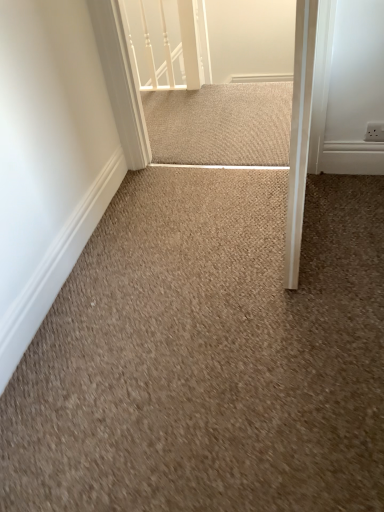
Question: Is beige textured mat at center oriented away from beige carpet at center?

Choices:
 (A) yes
 (B) no

Answer: (B)

Question: Is beige carpet at center inside beige textured mat at center?

Choices:
 (A) yes
 (B) no

Answer: (B)

Question: Is beige textured mat at center positioned far away from beige carpet at center?

Choices:
 (A) yes
 (B) no

Answer: (A)

Question: Is beige textured mat at center beside beige carpet at center?

Choices:
 (A) yes
 (B) no

Answer: (B)

Question: From a real-world perspective, is beige textured mat at center physically below beige carpet at center?

Choices:
 (A) yes
 (B) no

Answer: (B)

Question: From the image's perspective, relative to beige carpet at center, is white glossy rail at upper center above or below?

Choices:
 (A) below
 (B) above

Answer: (B)

Question: Is white glossy rail at upper center bigger or smaller than beige carpet at center?

Choices:
 (A) small
 (B) big

Answer: (A)

Question: Relative to beige carpet at center, is white glossy rail at upper center in front or behind?

Choices:
 (A) behind
 (B) front

Answer: (A)

Question: Considering the relative positions of white glossy rail at upper center and beige carpet at center in the image provided, is white glossy rail at upper center to the left or to the right of beige carpet at center?

Choices:
 (A) right
 (B) left

Answer: (B)

Question: Relative to beige textured mat at center, is beige carpet at center in front or behind?

Choices:
 (A) front
 (B) behind

Answer: (A)

Question: Looking at the image, does beige carpet at center seem bigger or smaller compared to beige textured mat at center?

Choices:
 (A) big
 (B) small

Answer: (A)

Question: From a real-world perspective, relative to beige textured mat at center, is beige carpet at center vertically above or below?

Choices:
 (A) above
 (B) below

Answer: (B)

Question: Is beige carpet at center wider or thinner than beige textured mat at center?

Choices:
 (A) thin
 (B) wide

Answer: (B)

Question: Is beige carpet at center wider or thinner than white glossy rail at upper center?

Choices:
 (A) wide
 (B) thin

Answer: (A)

Question: Is beige carpet at center taller or shorter than white glossy rail at upper center?

Choices:
 (A) short
 (B) tall

Answer: (A)